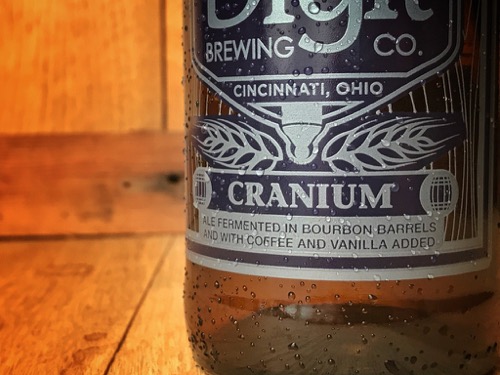
Locate an element on the screen. floor is located at coordinates (99, 297).